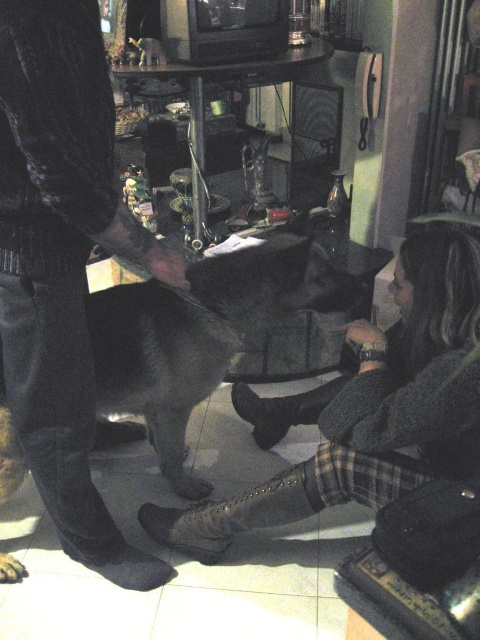
Question: Does dark gray sweater at center appear on the right side of shiny black dog at center?

Choices:
 (A) yes
 (B) no

Answer: (A)

Question: Which object appears farthest from the camera in this image?

Choices:
 (A) leather boot at lower center
 (B) dark gray sweater at center
 (C) shiny black dog at center
 (D) dark corduroy pants at left

Answer: (C)

Question: Which of the following is the closest to the observer?

Choices:
 (A) dark corduroy pants at left
 (B) dark gray sweater at center
 (C) leather boot at lower center
 (D) shiny black dog at center

Answer: (A)

Question: Which of the following is the farthest from the observer?

Choices:
 (A) (379, 342)
 (B) (39, 220)

Answer: (A)

Question: Is dark gray sweater at center to the left of shiny black dog at center from the viewer's perspective?

Choices:
 (A) yes
 (B) no

Answer: (B)

Question: Is dark corduroy pants at left thinner than leather boot at lower center?

Choices:
 (A) yes
 (B) no

Answer: (A)